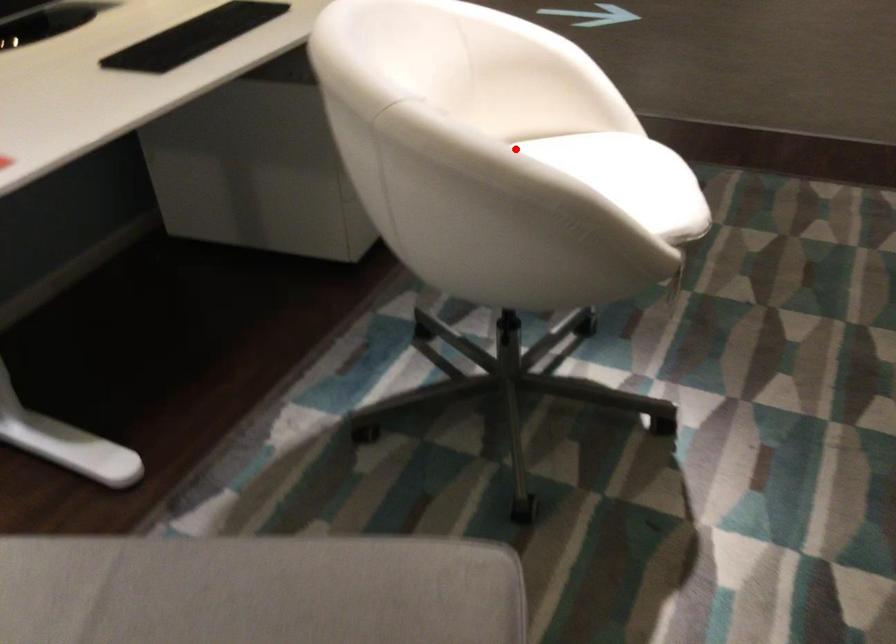
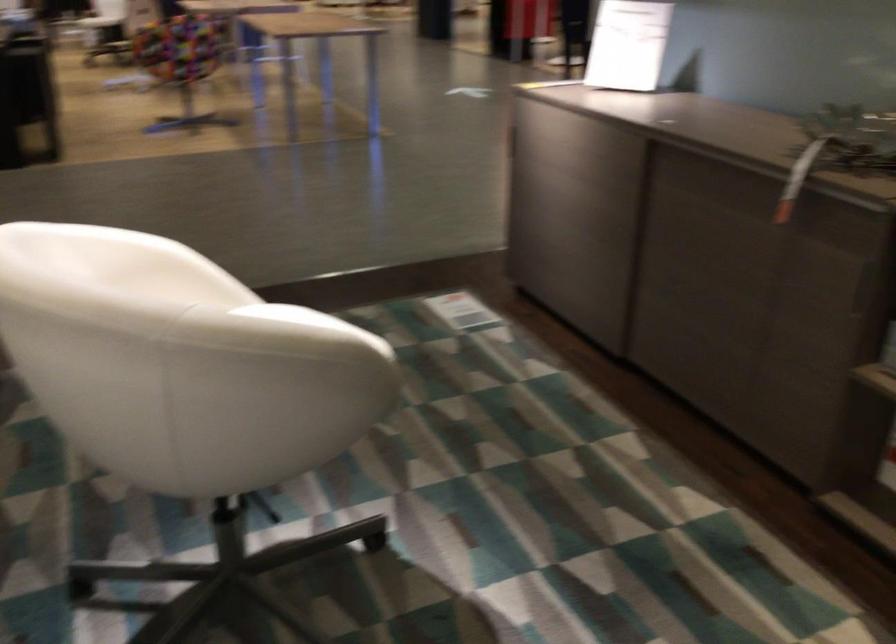
The point at the highlighted location is marked in the first image. Where is the corresponding point in the second image?

(307, 321)